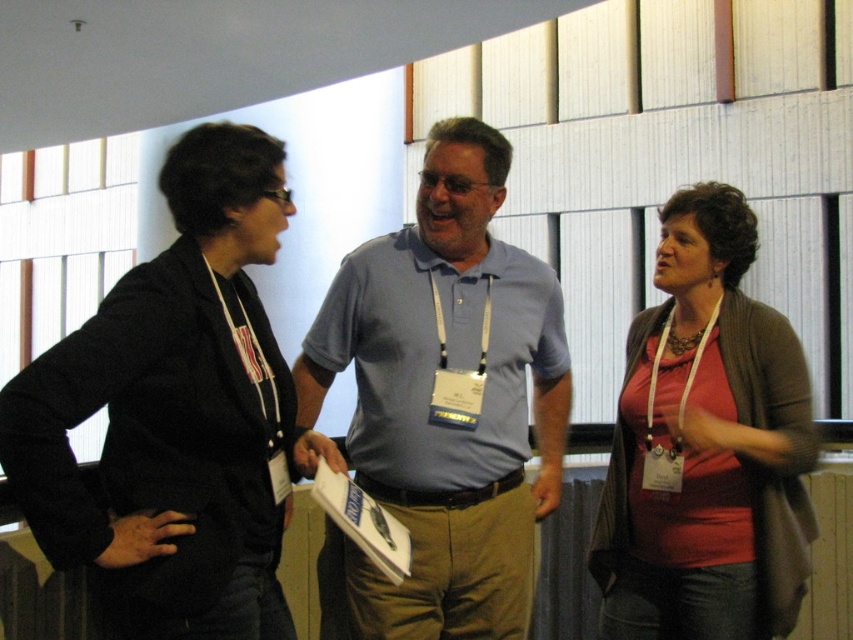
You are an event organizer who needs to take a photo of the matte red shirt at center and the light blue cotton shirt at center. Which one should you focus on first to ensure both are in focus?

The light blue cotton shirt at center is closer to the viewer than the matte red shirt at center, so you should focus on the light blue cotton shirt at center first to ensure both are in focus.

You are standing in the conference room and want to approach the person wearing a matte black blazer at left. To do so, should you walk towards the point at coordinates [177,413]?

Yes, because the matte black blazer at left is located at point [177,413].

You are standing at the point with coordinates point (225, 381) and want to walk to the point with coordinates point (740, 572). Which direction should you move in?

You should move backward because point (225, 381) is in front of point (740, 572).